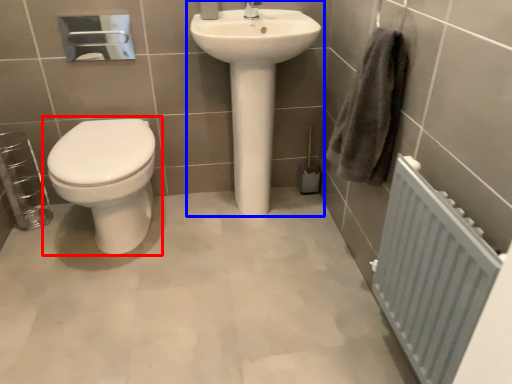
Question: Among these objects, which one is nearest to the camera, toilet (highlighted by a red box) or sink (highlighted by a blue box)?

Choices:
 (A) toilet
 (B) sink

Answer: (A)